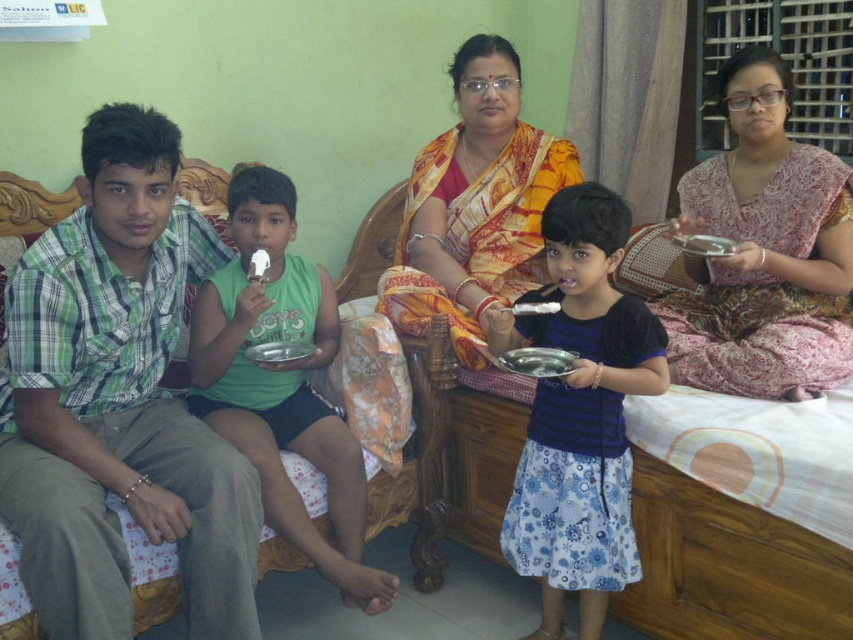
Is yellow-orange sari at center to the right of silver metallic tray at center from the viewer's perspective?

Yes, yellow-orange sari at center is to the right of silver metallic tray at center.

Which is more to the right, yellow-orange sari at center or silver metallic tray at center?

yellow-orange sari at center is more to the right.

Between point (438, 300) and point (265, 362), which one is positioned in front?

Point (265, 362) is in front.

Identify the location of yellow-orange sari at center. (474, 204).

Does blue floral dress at center lie behind metallic silver tray at center?

Yes, blue floral dress at center is behind metallic silver tray at center.

Looking at this image, which is below, blue floral dress at center or metallic silver tray at center?

blue floral dress at center is lower down.

You are a GUI agent. You are given a task and a screenshot of the screen. Output one action in this format:
    pyautogui.click(x=<x>, y=<y>)
    Task: Click on the blue floral dress at center
    This screenshot has height=640, width=853.
    Given the screenshot: What is the action you would take?
    pyautogui.click(x=579, y=413)

Image resolution: width=853 pixels, height=640 pixels. Find the location of `blue floral dress at center`. blue floral dress at center is located at coordinates (579, 413).

Is green plaid shirt at left bigger than pink floral saree at upper right?

Yes.

Is green plaid shirt at left shorter than pink floral saree at upper right?

In fact, green plaid shirt at left may be taller than pink floral saree at upper right.

Who is more forward, (22, 512) or (846, 324)?

Positioned in front is point (22, 512).

This screenshot has width=853, height=640. I want to click on green plaid shirt at left, so click(x=119, y=401).